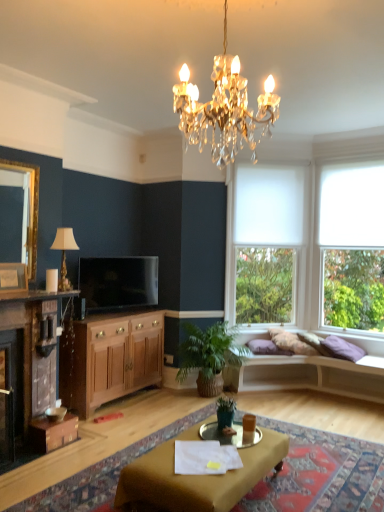
Question: Is green woven basket at lower center, marked as the 1th houseplant in a back-to-front arrangement, looking in the opposite direction of purple velvet pillow at right?

Choices:
 (A) no
 (B) yes

Answer: (A)

Question: From a real-world perspective, is green woven basket at lower center, marked as the 1th houseplant in a back-to-front arrangement, on purple velvet pillow at right?

Choices:
 (A) yes
 (B) no

Answer: (B)

Question: Is green woven basket at lower center, which ranks as the second houseplant in front-to-back order, wider than purple velvet pillow at right?

Choices:
 (A) yes
 (B) no

Answer: (A)

Question: Is green woven basket at lower center, which ranks as the second houseplant in front-to-back order, shorter than purple velvet pillow at right?

Choices:
 (A) no
 (B) yes

Answer: (A)

Question: Is the position of green woven basket at lower center, marked as the 1th houseplant in a back-to-front arrangement, less distant than that of purple velvet pillow at right?

Choices:
 (A) no
 (B) yes

Answer: (B)

Question: Considering the relative positions of green woven basket at lower center, which ranks as the second houseplant in front-to-back order, and purple velvet pillow at right in the image provided, is green woven basket at lower center, which ranks as the second houseplant in front-to-back order, to the right of purple velvet pillow at right from the viewer's perspective?

Choices:
 (A) no
 (B) yes

Answer: (A)

Question: Would you say matte gold picture frame at left is a long distance from flat screen tv at center?

Choices:
 (A) yes
 (B) no

Answer: (A)

Question: Is matte gold picture frame at left shorter than flat screen tv at center?

Choices:
 (A) no
 (B) yes

Answer: (B)

Question: From the image's perspective, is matte gold picture frame at left located beneath flat screen tv at center?

Choices:
 (A) yes
 (B) no

Answer: (B)

Question: Is matte gold picture frame at left oriented towards flat screen tv at center?

Choices:
 (A) yes
 (B) no

Answer: (B)

Question: Is the depth of matte gold picture frame at left greater than that of flat screen tv at center?

Choices:
 (A) no
 (B) yes

Answer: (A)

Question: Can you confirm if matte gold picture frame at left is wider than flat screen tv at center?

Choices:
 (A) no
 (B) yes

Answer: (A)

Question: Is transparent glass window at right, placed as the first window when sorted from right to left, to the right of purple velvet pillow at right from the viewer's perspective?

Choices:
 (A) yes
 (B) no

Answer: (A)